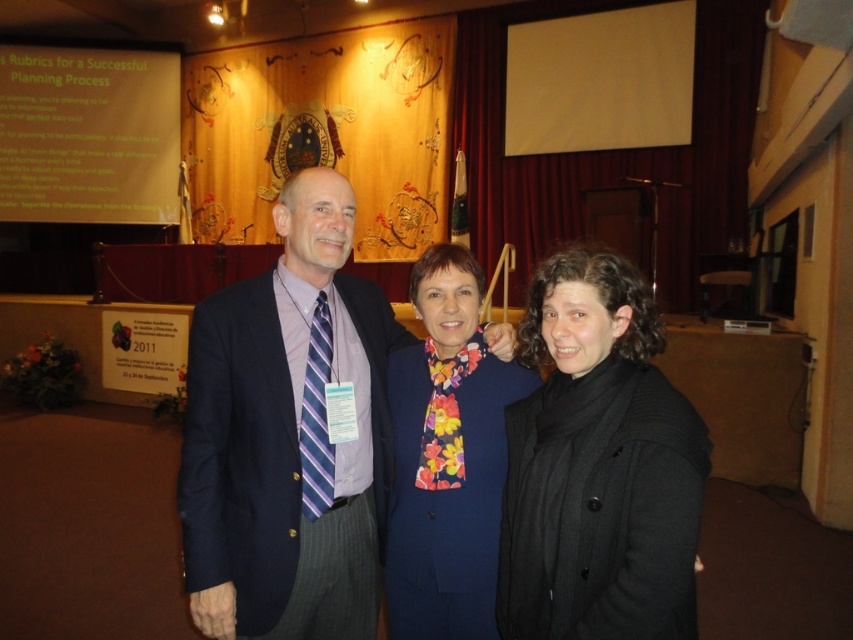
Is black wool coat at center thinner than white matte projection screen at upper center?

Yes.

Can you confirm if black wool coat at center is positioned to the left of white matte projection screen at upper center?

Correct, you'll find black wool coat at center to the left of white matte projection screen at upper center.

Between point (630, 349) and point (659, 56), which one is positioned in front?

Point (630, 349) is in front.

Find the location of a particular element. The image size is (853, 640). black wool coat at center is located at coordinates (598, 467).

Can you confirm if dark blue suit at center is smaller than floral scarf at center?

Incorrect, dark blue suit at center is not smaller in size than floral scarf at center.

Which is in front, point (289, 522) or point (445, 456)?

Point (289, 522) is more forward.

Between point (294, 458) and point (461, 634), which one is positioned in front?

Positioned in front is point (294, 458).

Identify the location of dark blue suit at center. (288, 435).

Does dark blue suit at center have a greater width compared to black wool coat at center?

Yes, dark blue suit at center is wider than black wool coat at center.

Based on the photo, is dark blue suit at center closer to camera compared to black wool coat at center?

No, dark blue suit at center is further to the viewer.

Is point (247, 289) more distant than point (633, 381)?

Yes, it is behind point (633, 381).

Image resolution: width=853 pixels, height=640 pixels. What are the coordinates of `dark blue suit at center` in the screenshot? It's located at (288, 435).